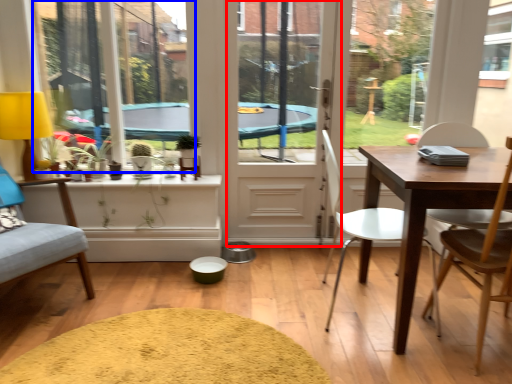
Question: Which object appears closest to the camera in this image, screen door (highlighted by a red box) or window screen (highlighted by a blue box)?

Choices:
 (A) screen door
 (B) window screen

Answer: (B)